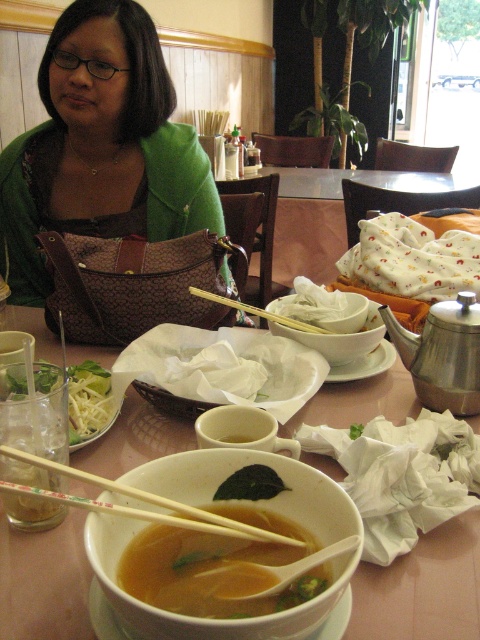
Question: Which of the following is the closest to the observer?

Choices:
 (A) (78, 365)
 (B) (237, 504)
 (C) (153, 230)

Answer: (B)

Question: Which object is positioned closest to the white matte bowl at center?

Choices:
 (A) translucent glass bowl at center
 (B) green fabric shirt at upper left
 (C) translucent broth soup at center
 (D) translucent glass cup at lower left

Answer: (A)

Question: Where is translucent ceramic bowl at center located in relation to wooden chopsticks at bowl center in the image?

Choices:
 (A) above
 (B) below

Answer: (B)

Question: Among these points, which one is nearest to the camera?

Choices:
 (A) (92, 417)
 (B) (59, 29)

Answer: (A)

Question: Can you confirm if green fabric shirt at upper left is positioned to the right of translucent ceramic bowl at center?

Choices:
 (A) yes
 (B) no

Answer: (B)

Question: Does green fabric shirt at upper left have a smaller size compared to wooden chopsticks at center?

Choices:
 (A) no
 (B) yes

Answer: (A)